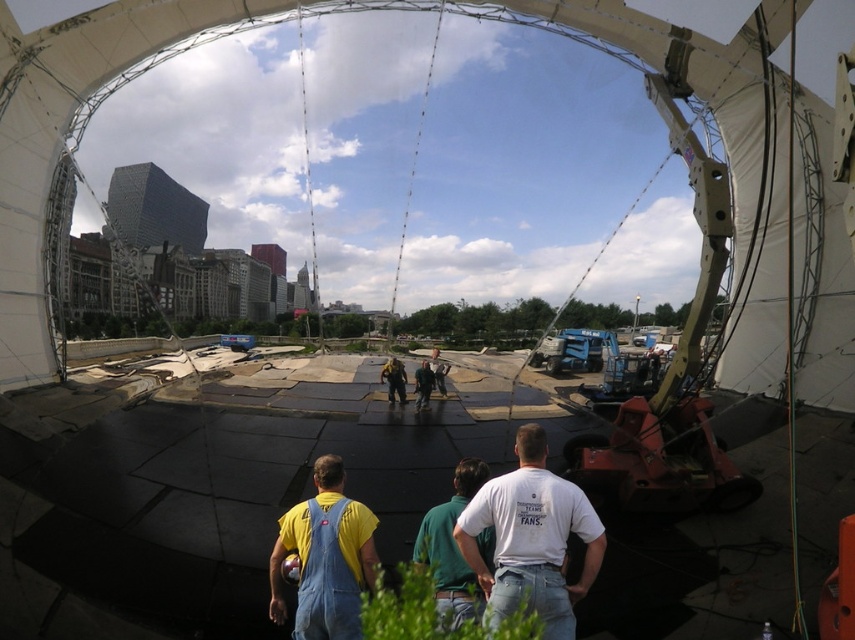
From the picture: You are standing at the point marked as point (466, 604). You want to move to the other side of the structure. The structure is 5 meters wide. Can you walk straight ahead without crossing the structure?

The distance between the two points is 2.42 meters, which is less than the structure width of 5 meters. Therefore, you can walk straight ahead without crossing the structure.